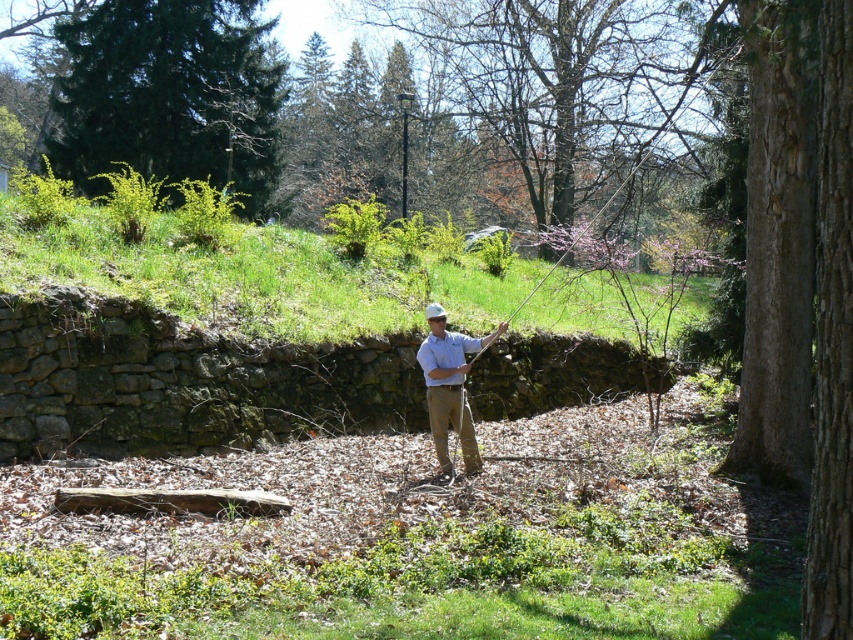
Question: Does green textured evergreen tree at upper left have a larger size compared to light blue shirt at center?

Choices:
 (A) yes
 (B) no

Answer: (A)

Question: Does green textured evergreen tree at upper left lie in front of light blue shirt at center?

Choices:
 (A) yes
 (B) no

Answer: (B)

Question: Which is nearer to the green textured evergreen tree at upper left?

Choices:
 (A) light blue shirt at center
 (B) bare branches at upper center

Answer: (B)

Question: Which object appears farthest from the camera in this image?

Choices:
 (A) light blue shirt at center
 (B) green textured evergreen tree at upper left

Answer: (B)

Question: Does bare branches at upper center come in front of green textured evergreen tree at upper left?

Choices:
 (A) no
 (B) yes

Answer: (B)

Question: Which object appears closest to the camera in this image?

Choices:
 (A) green textured evergreen tree at upper left
 (B) bare branches at upper center
 (C) light blue shirt at center

Answer: (C)